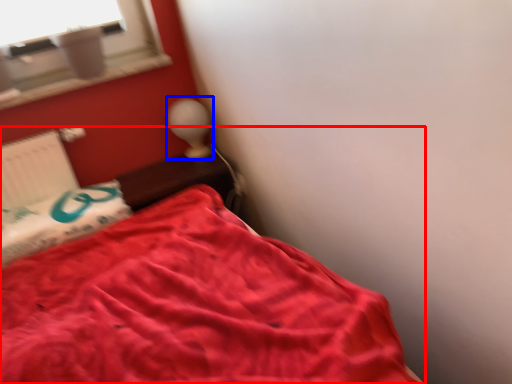
Question: Which point is closer to the camera, bed (highlighted by a red box) or table lamp (highlighted by a blue box)?

Choices:
 (A) bed
 (B) table lamp

Answer: (A)